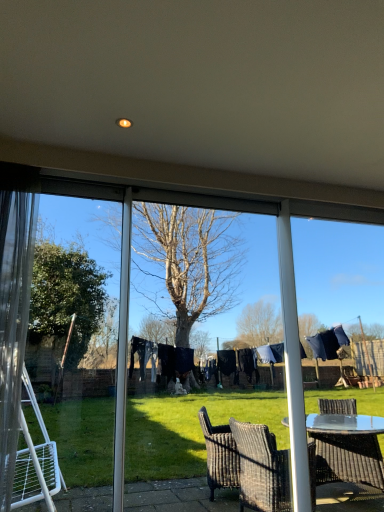
How much space does transparent plastic screen door at center, the second screen door viewed from the left, occupy horizontally?

4.10 inches.

What is the approximate height of transparent plastic screen door at center, which ranks as the 1th screen door in right-to-left order?

transparent plastic screen door at center, which ranks as the 1th screen door in right-to-left order, is 1.73 meters in height.

This screenshot has height=512, width=384. Describe the element at coordinates (78, 337) in the screenshot. I see `transparent glass screen door at left, which ranks as the first screen door in left-to-right order` at that location.

This screenshot has width=384, height=512. In order to click on clear glass window frame at right in this screenshot , I will do `click(338, 272)`.

The image size is (384, 512). In the image, there is a transparent plastic screen door at center, which ranks as the 1th screen door in right-to-left order. In order to click on window frame below it (from a real-world perspective) in this screenshot , I will do `click(338, 272)`.

What's the angular difference between transparent plastic screen door at center, which ranks as the 1th screen door in right-to-left order, and clear glass window frame at right's facing directions?

0.00434 degrees separate the facing orientations of transparent plastic screen door at center, which ranks as the 1th screen door in right-to-left order, and clear glass window frame at right.

Does transparent plastic screen door at center, which ranks as the 1th screen door in right-to-left order, have a lesser width compared to clear glass window frame at right?

Indeed, transparent plastic screen door at center, which ranks as the 1th screen door in right-to-left order, has a lesser width compared to clear glass window frame at right.

Which is less distant, (346, 303) or (36, 374)?

The point (346, 303) is more forward.

Would you say clear glass window frame at right is a long distance from transparent glass screen door at left, which ranks as the first screen door in left-to-right order?

Yes, clear glass window frame at right and transparent glass screen door at left, which ranks as the first screen door in left-to-right order, are quite far apart.

Which of these two, clear glass window frame at right or transparent glass screen door at left, the second screen door from the right, is thinner?

Thinner between the two is transparent glass screen door at left, the second screen door from the right.

Between clear glass window frame at right and transparent glass screen door at left, the second screen door from the right, which one appears on the right side from the viewer's perspective?

clear glass window frame at right is more to the right.

How far apart are clear glass window frame at right and transparent plastic screen door at center, which ranks as the 1th screen door in right-to-left order?

They are 20.34 feet apart.

Is transparent plastic screen door at center, the second screen door viewed from the left, surrounded by clear glass window frame at right?

No, transparent plastic screen door at center, the second screen door viewed from the left, is located outside of clear glass window frame at right.

How many degrees apart are the facing directions of clear glass window frame at right and transparent plastic screen door at center, which ranks as the 1th screen door in right-to-left order?

clear glass window frame at right and transparent plastic screen door at center, which ranks as the 1th screen door in right-to-left order, are facing 0.00434 degrees away from each other.

Is clear glass window frame at right oriented towards transparent plastic screen door at center, which ranks as the 1th screen door in right-to-left order?

No.

Which is behind, point (58, 249) or point (202, 301)?

The point (202, 301) is farther.

From a real-world perspective, is transparent glass screen door at left, the second screen door from the right, positioned under transparent plastic screen door at center, the second screen door viewed from the left, based on gravity?

Incorrect, from a real-world perspective, transparent glass screen door at left, the second screen door from the right, is higher than transparent plastic screen door at center, the second screen door viewed from the left.

Considering the relative sizes of transparent glass screen door at left, the second screen door from the right, and transparent plastic screen door at center, which ranks as the 1th screen door in right-to-left order, in the image provided, is transparent glass screen door at left, the second screen door from the right, taller than transparent plastic screen door at center, which ranks as the 1th screen door in right-to-left order,?

Incorrect, the height of transparent glass screen door at left, the second screen door from the right, is not larger of that of transparent plastic screen door at center, which ranks as the 1th screen door in right-to-left order.

Which is correct: transparent glass screen door at left, which ranks as the first screen door in left-to-right order, is inside transparent plastic screen door at center, the second screen door viewed from the left, or outside of it?

transparent glass screen door at left, which ranks as the first screen door in left-to-right order, is not inside transparent plastic screen door at center, the second screen door viewed from the left, it's outside.

Is transparent plastic screen door at center, which ranks as the 1th screen door in right-to-left order, positioned far away from transparent glass screen door at left, which ranks as the first screen door in left-to-right order?

Absolutely, transparent plastic screen door at center, which ranks as the 1th screen door in right-to-left order, is distant from transparent glass screen door at left, which ranks as the first screen door in left-to-right order.

Is point (274, 361) positioned in front of point (103, 336)?

Yes, point (274, 361) is in front of point (103, 336).

From a real-world perspective, is transparent plastic screen door at center, which ranks as the 1th screen door in right-to-left order, physically above transparent glass screen door at left, the second screen door from the right?

No.

Between point (45, 335) and point (311, 270), which one is positioned in front?

The point (311, 270) is in front.

Is transparent glass screen door at left, which ranks as the first screen door in left-to-right order, in front of or behind clear glass window frame at right in the image?

Clearly, transparent glass screen door at left, which ranks as the first screen door in left-to-right order, is in front of clear glass window frame at right.

Is transparent glass screen door at left, the second screen door from the right, spatially inside clear glass window frame at right, or outside of it?

transparent glass screen door at left, the second screen door from the right, is not enclosed by clear glass window frame at right.

This screenshot has width=384, height=512. I want to click on screen door that is the 1st one above the clear glass window frame at right (from a real-world perspective), so click(x=191, y=326).

The image size is (384, 512). I want to click on window frame lying below the transparent glass screen door at left, the second screen door from the right (from the image's perspective), so click(x=338, y=272).

Considering their positions, is transparent glass screen door at left, which ranks as the first screen door in left-to-right order, positioned further to clear glass window frame at right than transparent plastic screen door at center, which ranks as the 1th screen door in right-to-left order?

transparent plastic screen door at center, which ranks as the 1th screen door in right-to-left order, lies further to clear glass window frame at right than the other object.

In the scene shown: Considering their positions, is clear glass window frame at right positioned closer to transparent glass screen door at left, the second screen door from the right, than transparent plastic screen door at center, the second screen door viewed from the left?

The object closer to transparent glass screen door at left, the second screen door from the right, is transparent plastic screen door at center, the second screen door viewed from the left.

When comparing their distances from transparent plastic screen door at center, which ranks as the 1th screen door in right-to-left order, does clear glass window frame at right or transparent glass screen door at left, which ranks as the first screen door in left-to-right order, seem closer?

transparent glass screen door at left, which ranks as the first screen door in left-to-right order, lies closer to transparent plastic screen door at center, which ranks as the 1th screen door in right-to-left order, than the other object.

When comparing their distances from transparent plastic screen door at center, the second screen door viewed from the left, does transparent glass screen door at left, the second screen door from the right, or clear glass window frame at right seem further?

The object further to transparent plastic screen door at center, the second screen door viewed from the left, is clear glass window frame at right.

Estimate the real-world distances between objects in this image. Which object is further from transparent glass screen door at left, which ranks as the first screen door in left-to-right order, transparent plastic screen door at center, the second screen door viewed from the left, or clear glass window frame at right?

Based on the image, clear glass window frame at right appears to be further to transparent glass screen door at left, which ranks as the first screen door in left-to-right order.

Based on their spatial positions, is transparent plastic screen door at center, which ranks as the 1th screen door in right-to-left order, or transparent glass screen door at left, the second screen door from the right, closer to clear glass window frame at right?

The object closer to clear glass window frame at right is transparent glass screen door at left, the second screen door from the right.

Identify the location of screen door between transparent glass screen door at left, the second screen door from the right, and clear glass window frame at right. The width and height of the screenshot is (384, 512). (191, 326).